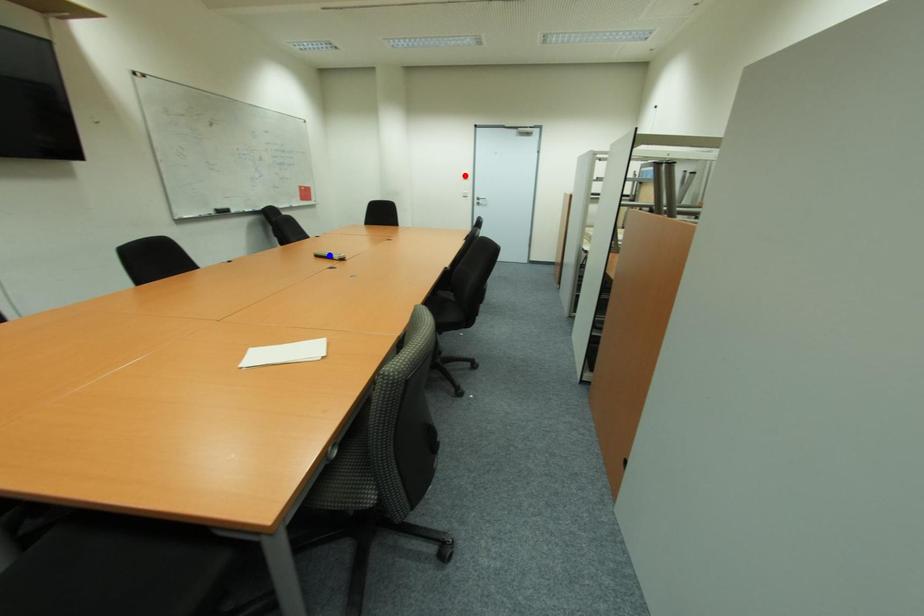
Question: In the image, two points are highlighted. Which point is nearer to the camera? Reply with the corresponding letter.

Choices:
 (A) blue point
 (B) red point

Answer: (A)